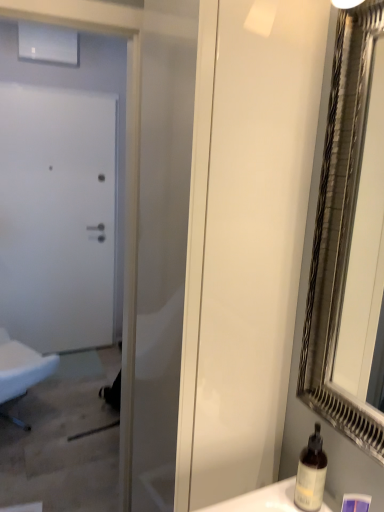
Question: Is white matte door at left taller than white fabric chair at left?

Choices:
 (A) yes
 (B) no

Answer: (A)

Question: Would you say white matte door at left is outside white fabric chair at left?

Choices:
 (A) no
 (B) yes

Answer: (B)

Question: Is white matte door at left positioned in front of white fabric chair at left?

Choices:
 (A) no
 (B) yes

Answer: (A)

Question: Can you confirm if white matte door at left is smaller than white fabric chair at left?

Choices:
 (A) no
 (B) yes

Answer: (B)

Question: Does white matte door at left appear on the right side of white fabric chair at left?

Choices:
 (A) no
 (B) yes

Answer: (B)

Question: From the image's perspective, is white matte door at left on white fabric chair at left?

Choices:
 (A) no
 (B) yes

Answer: (B)

Question: Is white matte door at left in front of white glossy screen door at center?

Choices:
 (A) yes
 (B) no

Answer: (B)

Question: Does white matte door at left turn towards white glossy screen door at center?

Choices:
 (A) no
 (B) yes

Answer: (B)

Question: Is white matte door at left not inside white glossy screen door at center?

Choices:
 (A) no
 (B) yes

Answer: (B)

Question: Is white matte door at left thinner than white glossy screen door at center?

Choices:
 (A) yes
 (B) no

Answer: (A)

Question: Considering the relative positions of white matte door at left and white glossy screen door at center in the image provided, is white matte door at left behind white glossy screen door at center?

Choices:
 (A) no
 (B) yes

Answer: (B)

Question: Is white matte door at left wider than white glossy screen door at center?

Choices:
 (A) yes
 (B) no

Answer: (B)

Question: From a real-world perspective, is translucent glass bottle at lower right located beneath white fabric chair at left?

Choices:
 (A) yes
 (B) no

Answer: (B)